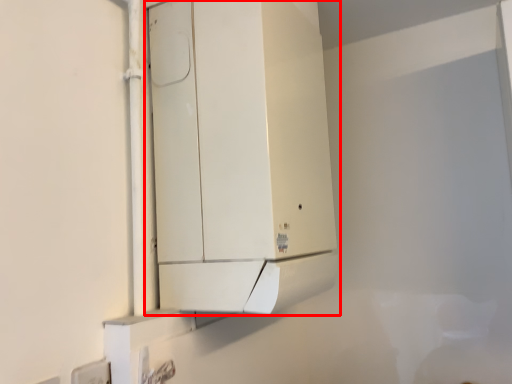
Question: In this image, where is cabinetry (annotated by the red box) located relative to electric outlet?

Choices:
 (A) left
 (B) right

Answer: (B)